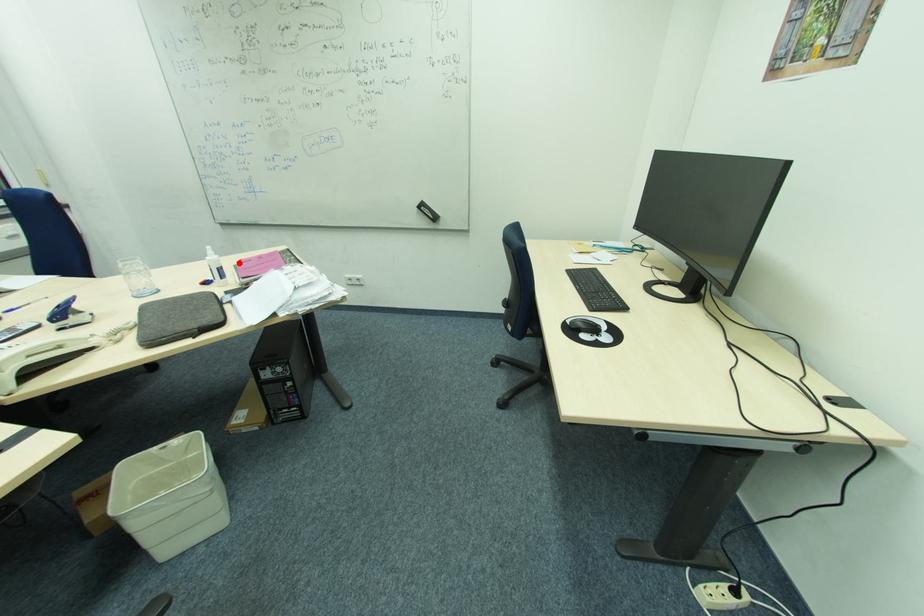
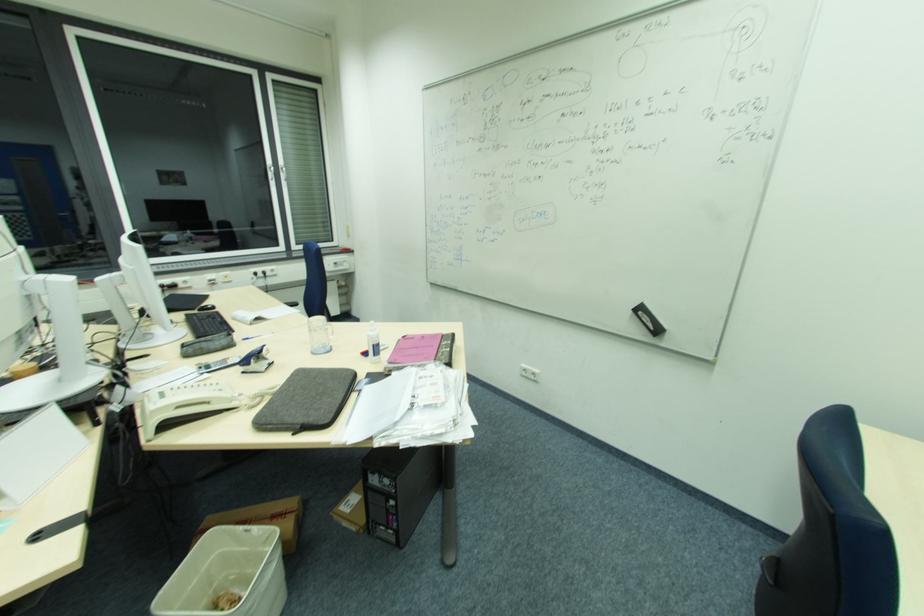
Question: I am providing you with two images of the same scene from different viewpoints. A red point is marked on the first image. Can you still see the location of the red point in image 2?

Choices:
 (A) Yes
 (B) No

Answer: (A)